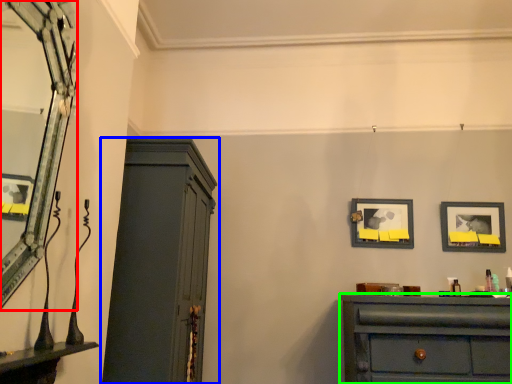
Question: Based on their relative distances, which object is nearer to mirror (highlighted by a red box)? Choose from cupboard (highlighted by a blue box) and chest of drawers (highlighted by a green box).

Choices:
 (A) cupboard
 (B) chest of drawers

Answer: (A)